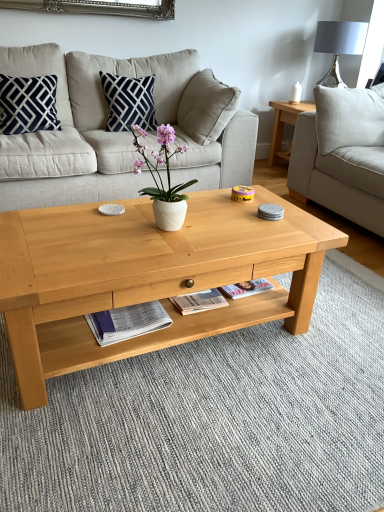
Measure the distance between point (x=120, y=118) and camera.

Point (x=120, y=118) and camera are 2.93 meters apart.

Locate an element on the screen. Image resolution: width=384 pixels, height=512 pixels. beige fabric couch at center, placed as the 2th studio couch when sorted from right to left is located at coordinates (120, 132).

Does beige fabric couch at center, placed as the 2th studio couch when sorted from right to left, appear on the left side of navy blue fabric pillow at upper center, which ranks as the 2th pillow in left-to-right order?

Yes.

From a real-world perspective, is beige fabric couch at center, placed as the 2th studio couch when sorted from right to left, physically located above or below navy blue fabric pillow at upper center, which is counted as the 1th pillow, starting from the right?

beige fabric couch at center, placed as the 2th studio couch when sorted from right to left, is situated lower than navy blue fabric pillow at upper center, which is counted as the 1th pillow, starting from the right, in the real world.

Is beige fabric couch at center, placed as the 2th studio couch when sorted from right to left, taller than navy blue fabric pillow at upper center, which ranks as the 2th pillow in left-to-right order?

Indeed, beige fabric couch at center, placed as the 2th studio couch when sorted from right to left, has a greater height compared to navy blue fabric pillow at upper center, which ranks as the 2th pillow in left-to-right order.

Could you tell me if beige fabric couch at center, the first studio couch from the left, is facing navy blue fabric pillow at upper center, which ranks as the 2th pillow in left-to-right order?

Yes, beige fabric couch at center, the first studio couch from the left, is turned towards navy blue fabric pillow at upper center, which ranks as the 2th pillow in left-to-right order.

Are navy blue fabric pillow at upper center, which is counted as the 1th pillow, starting from the right, and navy blue velvet pillow at upper left, which is counted as the 1th pillow, starting from the left, located far from each other?

Actually, navy blue fabric pillow at upper center, which is counted as the 1th pillow, starting from the right, and navy blue velvet pillow at upper left, which is counted as the 1th pillow, starting from the left, are a little close together.

Is navy blue fabric pillow at upper center, which ranks as the 2th pillow in left-to-right order, taller than navy blue velvet pillow at upper left, marked as the second pillow in a right-to-left arrangement?

Indeed, navy blue fabric pillow at upper center, which ranks as the 2th pillow in left-to-right order, has a greater height compared to navy blue velvet pillow at upper left, marked as the second pillow in a right-to-left arrangement.

Can we say navy blue fabric pillow at upper center, which is counted as the 1th pillow, starting from the right, lies outside navy blue velvet pillow at upper left, marked as the second pillow in a right-to-left arrangement?

Yes.

From a real-world perspective, is natural wood coffee table at center beneath navy blue fabric pillow at upper center, which is counted as the 1th pillow, starting from the right?

Indeed, from a real-world perspective, natural wood coffee table at center is positioned beneath navy blue fabric pillow at upper center, which is counted as the 1th pillow, starting from the right.

Which is more to the left, natural wood coffee table at center or navy blue fabric pillow at upper center, which is counted as the 1th pillow, starting from the right?

Positioned to the left is navy blue fabric pillow at upper center, which is counted as the 1th pillow, starting from the right.

Based on the photo, is natural wood coffee table at center next to navy blue fabric pillow at upper center, which ranks as the 2th pillow in left-to-right order?

No, natural wood coffee table at center is not next to navy blue fabric pillow at upper center, which ranks as the 2th pillow in left-to-right order.

Which of these two, natural wood coffee table at center or navy blue fabric pillow at upper center, which ranks as the 2th pillow in left-to-right order, is thinner?

navy blue fabric pillow at upper center, which ranks as the 2th pillow in left-to-right order.

This screenshot has height=512, width=384. I want to click on coffee table below the beige fabric couch at center, placed as the 2th studio couch when sorted from right to left (from the image's perspective), so click(x=146, y=276).

Can you tell me how much beige fabric couch at center, placed as the 2th studio couch when sorted from right to left, and natural wood coffee table at center differ in facing direction?

The angular difference between beige fabric couch at center, placed as the 2th studio couch when sorted from right to left, and natural wood coffee table at center is 0.505 degrees.

In the scene shown: Who is smaller, beige fabric couch at center, placed as the 2th studio couch when sorted from right to left, or natural wood coffee table at center?

natural wood coffee table at center is smaller.

Where is `lamp located on the right of white glossy magazine at lower center`? The height and width of the screenshot is (512, 384). lamp located on the right of white glossy magazine at lower center is located at coordinates (339, 45).

In the scene shown: Considering the sizes of matte gray lampshade at upper right and white glossy magazine at lower center in the image, is matte gray lampshade at upper right bigger or smaller than white glossy magazine at lower center?

matte gray lampshade at upper right is bigger than white glossy magazine at lower center.

Is matte gray lampshade at upper right taller or shorter than white glossy magazine at lower center?

Clearly, matte gray lampshade at upper right is taller compared to white glossy magazine at lower center.

Does matte gray lampshade at upper right appear on the right side of white glossy magazine at lower center?

Yes.

Does beige fabric couch at center, placed as the 2th studio couch when sorted from right to left, have a greater width compared to white glossy magazine at lower center?

Indeed, beige fabric couch at center, placed as the 2th studio couch when sorted from right to left, has a greater width compared to white glossy magazine at lower center.

Which is in front, beige fabric couch at center, placed as the 2th studio couch when sorted from right to left, or white glossy magazine at lower center?

white glossy magazine at lower center is more forward.

From their relative heights in the image, would you say beige fabric couch at center, the first studio couch from the left, is taller or shorter than white glossy magazine at lower center?

Considering their sizes, beige fabric couch at center, the first studio couch from the left, has more height than white glossy magazine at lower center.

From the image's perspective, relative to white glossy magazine at lower center, is beige fabric couch at center, the first studio couch from the left, above or below?

beige fabric couch at center, the first studio couch from the left, is above white glossy magazine at lower center.

Considering the sizes of objects navy blue fabric pillow at upper center, which is counted as the 1th pillow, starting from the right, and light gray fabric couch at right, the 1th studio couch from the right, in the image provided, who is smaller, navy blue fabric pillow at upper center, which is counted as the 1th pillow, starting from the right, or light gray fabric couch at right, the 1th studio couch from the right,?

With smaller size is navy blue fabric pillow at upper center, which is counted as the 1th pillow, starting from the right.

Does navy blue fabric pillow at upper center, which is counted as the 1th pillow, starting from the right, turn towards light gray fabric couch at right, which is the second studio couch from left to right?

No.

From a real-world perspective, is navy blue fabric pillow at upper center, which ranks as the 2th pillow in left-to-right order, located higher than light gray fabric couch at right, which is the second studio couch from left to right?

Correct, in the physical world, navy blue fabric pillow at upper center, which ranks as the 2th pillow in left-to-right order, is higher than light gray fabric couch at right, which is the second studio couch from left to right.

Which studio couch is the 1st one when counting from the front of the navy blue fabric pillow at upper center, which is counted as the 1th pillow, starting from the right? Please provide its 2D coordinates.

[(120, 132)]

Where is `pillow on the right of navy blue velvet pillow at upper left, which is counted as the 1th pillow, starting from the left`? pillow on the right of navy blue velvet pillow at upper left, which is counted as the 1th pillow, starting from the left is located at coordinates (129, 102).

Based on their spatial positions, is natural wood coffee table at center or white glossy magazine at lower center further from navy blue velvet pillow at upper left, marked as the second pillow in a right-to-left arrangement?

white glossy magazine at lower center.

Consider the image. Estimate the real-world distances between objects in this image. Which object is closer to light gray fabric couch at right, which is the second studio couch from left to right, beige fabric couch at center, the first studio couch from the left, or navy blue velvet pillow at upper left, which is counted as the 1th pillow, starting from the left?

beige fabric couch at center, the first studio couch from the left.

Considering their positions, is navy blue velvet pillow at upper left, which is counted as the 1th pillow, starting from the left, positioned closer to light gray fabric couch at right, the 1th studio couch from the right, than natural wood coffee table at center?

Based on the image, natural wood coffee table at center appears to be nearer to light gray fabric couch at right, the 1th studio couch from the right.

From the image, which object appears to be farther from navy blue fabric pillow at upper center, which is counted as the 1th pillow, starting from the right, natural wood coffee table at center or white matte vase at center?

natural wood coffee table at center lies further to navy blue fabric pillow at upper center, which is counted as the 1th pillow, starting from the right, than the other object.

Which object lies nearer to the anchor point matte gray lampshade at upper right, white matte vase at center or beige fabric couch at center, the first studio couch from the left?

Based on the image, beige fabric couch at center, the first studio couch from the left, appears to be nearer to matte gray lampshade at upper right.

Estimate the real-world distances between objects in this image. Which object is further from matte gray lampshade at upper right, beige fabric couch at center, placed as the 2th studio couch when sorted from right to left, or white matte vase at center?

white matte vase at center is positioned further to the anchor matte gray lampshade at upper right.

Which object lies nearer to the anchor point navy blue velvet pillow at upper left, which is counted as the 1th pillow, starting from the left, beige fabric couch at center, the first studio couch from the left, or matte gray lampshade at upper right?

beige fabric couch at center, the first studio couch from the left.

From the image, which object appears to be nearer to navy blue fabric pillow at upper center, which is counted as the 1th pillow, starting from the right, navy blue velvet pillow at upper left, marked as the second pillow in a right-to-left arrangement, or white matte vase at center?

Based on the image, navy blue velvet pillow at upper left, marked as the second pillow in a right-to-left arrangement, appears to be nearer to navy blue fabric pillow at upper center, which is counted as the 1th pillow, starting from the right.

The image size is (384, 512). I want to click on coffee table located between navy blue velvet pillow at upper left, which is counted as the 1th pillow, starting from the left, and light gray fabric couch at right, the 1th studio couch from the right, in the left-right direction, so click(146, 276).

The width and height of the screenshot is (384, 512). Identify the location of coffee table between beige fabric couch at center, the first studio couch from the left, and light gray fabric couch at right, which is the second studio couch from left to right. (146, 276).

I want to click on studio couch between navy blue velvet pillow at upper left, which is counted as the 1th pillow, starting from the left, and matte gray lampshade at upper right, in the horizontal direction, so click(120, 132).

Where is `magazine between natural wood coffee table at center and navy blue velvet pillow at upper left, marked as the second pillow in a right-to-left arrangement, along the z-axis`? The width and height of the screenshot is (384, 512). magazine between natural wood coffee table at center and navy blue velvet pillow at upper left, marked as the second pillow in a right-to-left arrangement, along the z-axis is located at coordinates (127, 322).